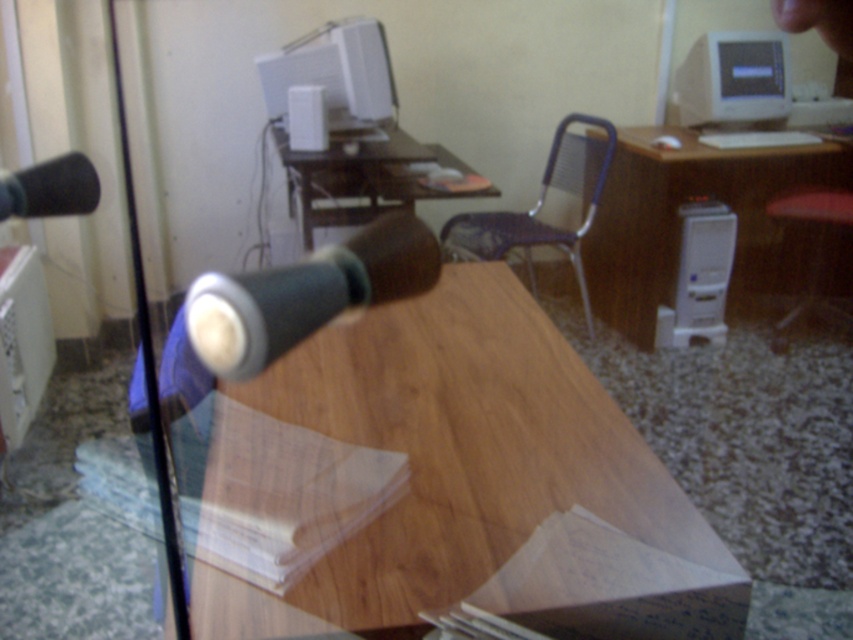
You are organizing a virtual meeting and need to ensure both the white plastic computer tower at right and the black matte microphone at left are visible to participants. Based on their positions in the image, which one is more likely to be obscured from the camera view?

The black matte microphone at left is behind the white plastic computer tower at right, so it is more likely to be obscured from the camera view.

You are sitting at the red cushioned stool at right and want to reach the matte wood computer desk at center. Which direction should you move to get there?

You should move to your left to reach the matte wood computer desk at center since it is located to the left of the red cushioned stool at right.

You are sitting at the matte wood computer desk at center and want to reach the red cushioned stool at right. Is the stool closer to you or farther away?

The red cushioned stool at right is farther away from you than the matte wood computer desk at center since the desk is closer to the viewer.